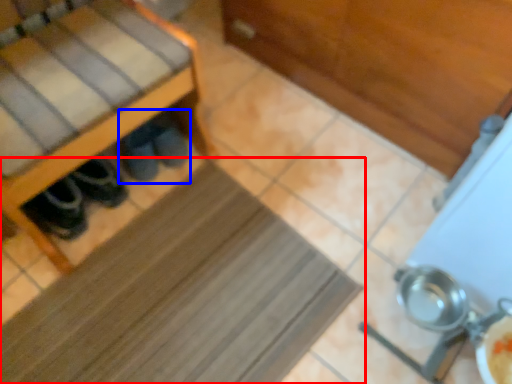
Question: Which object appears closest to the camera in this image, mat (highlighted by a red box) or footwear (highlighted by a blue box)?

Choices:
 (A) mat
 (B) footwear

Answer: (A)